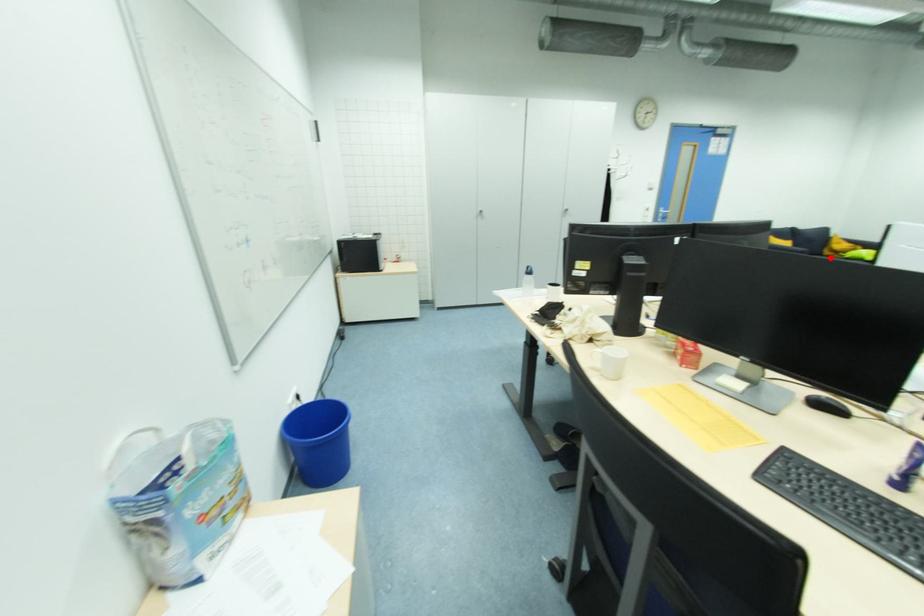
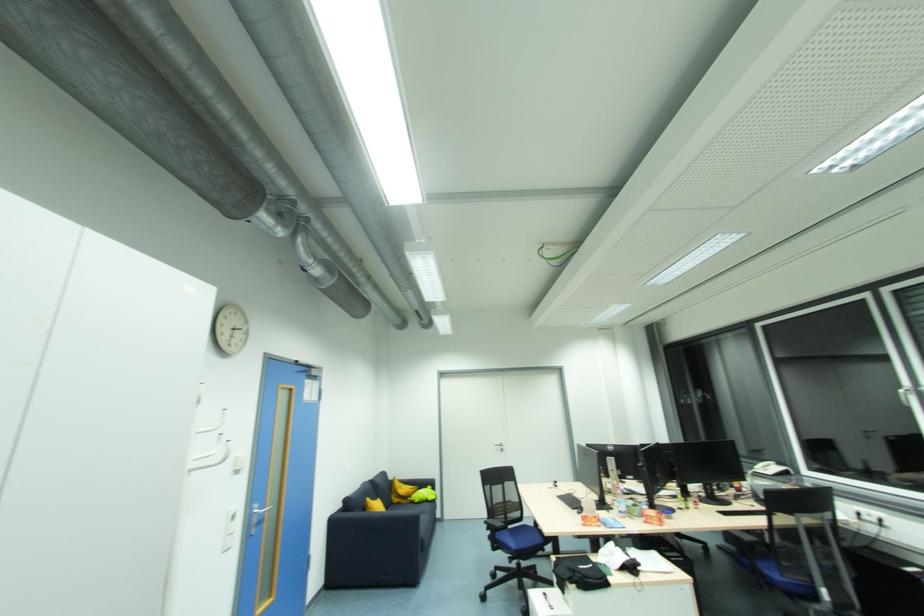
Locate, in the second image, the point that corresponds to the highlighted location in the first image.

(400, 505)